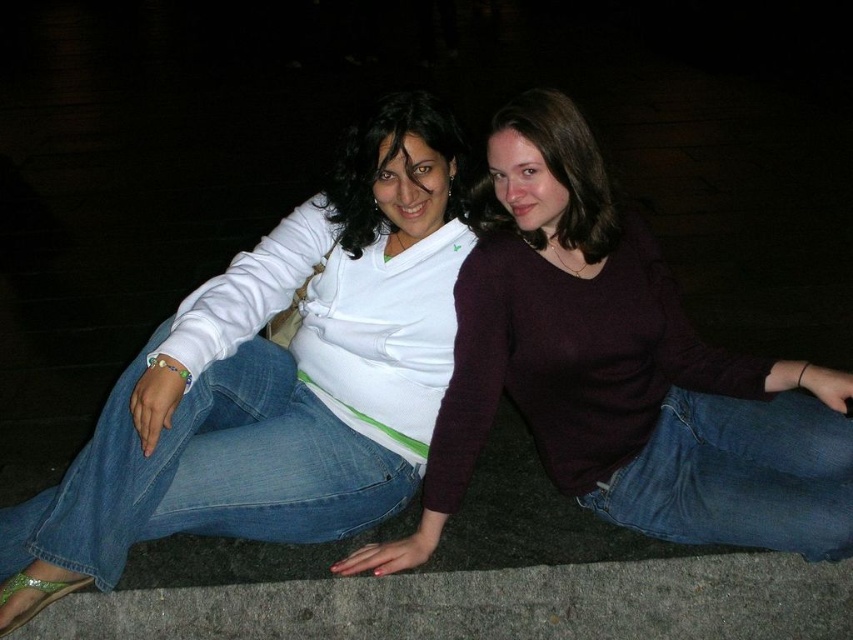
Question: Considering the real-world distances, which object is closest to the denim jeans at center?

Choices:
 (A) gray concrete at lower center
 (B) jeans at lower right

Answer: (A)

Question: Which object is closer to the camera taking this photo?

Choices:
 (A) matte white shirt at center
 (B) jeans at lower right
 (C) denim jeans at lower left
 (D) denim jeans at center

Answer: (D)

Question: Which object appears closest to the camera in this image?

Choices:
 (A) jeans at lower right
 (B) matte white shirt at center

Answer: (A)

Question: Is gray concrete at lower center positioned in front of jeans at lower right?

Choices:
 (A) yes
 (B) no

Answer: (B)

Question: Can you confirm if denim jeans at center is bigger than denim jeans at lower left?

Choices:
 (A) no
 (B) yes

Answer: (B)

Question: Can you confirm if gray concrete at lower center is positioned below matte white shirt at center?

Choices:
 (A) yes
 (B) no

Answer: (A)